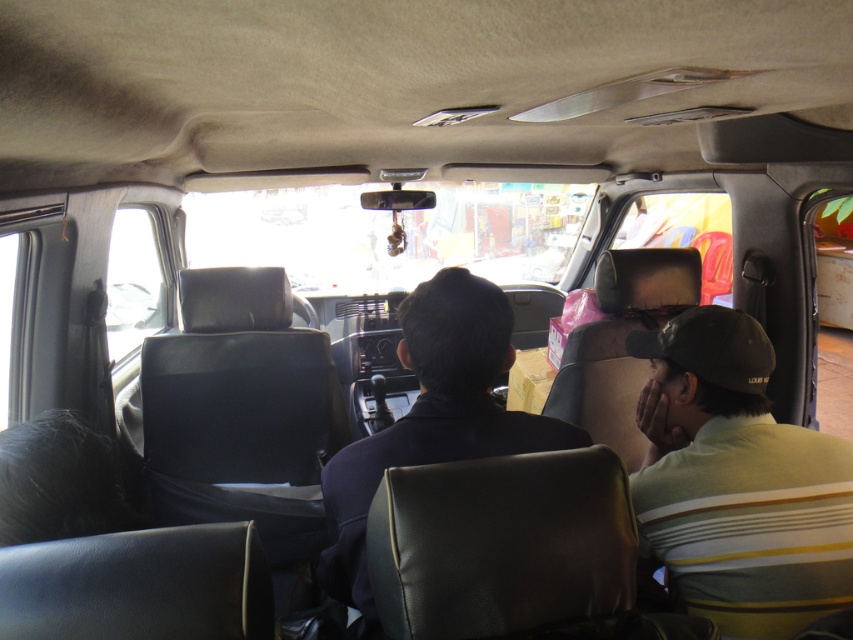
Question: Is green striped shirt at right in front of dark blue leather jacket at center?

Choices:
 (A) yes
 (B) no

Answer: (B)

Question: Can you confirm if green striped shirt at right is bigger than dark blue leather jacket at center?

Choices:
 (A) no
 (B) yes

Answer: (A)

Question: Among these objects, which one is farthest from the camera?

Choices:
 (A) dark blue leather jacket at center
 (B) green striped shirt at right

Answer: (B)

Question: Which point is farther from the camera taking this photo?

Choices:
 (A) (747, 506)
 (B) (460, 349)

Answer: (A)

Question: Can you confirm if green striped shirt at right is positioned to the left of dark blue leather jacket at center?

Choices:
 (A) yes
 (B) no

Answer: (B)